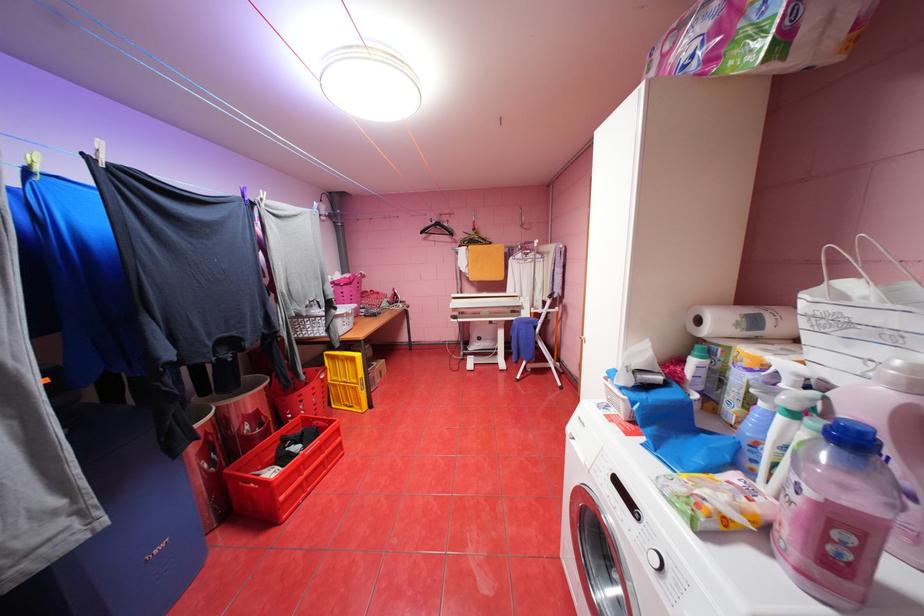
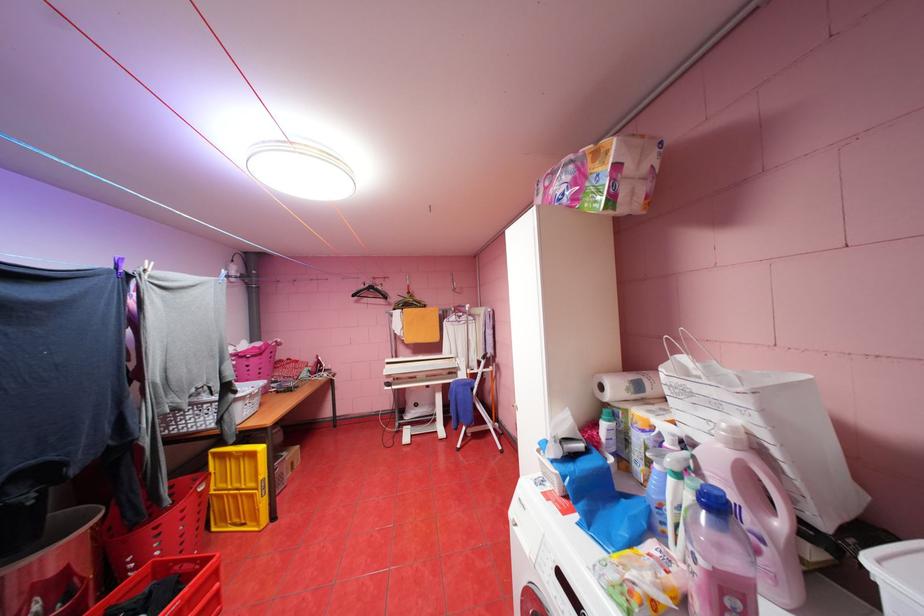
Find the pixel in the second image that matches (460,320) in the first image.

(395, 387)